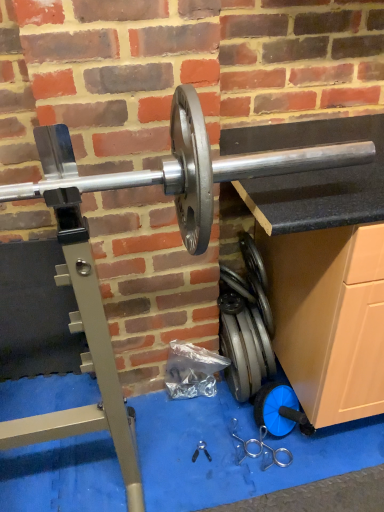
Question: Is the surface of black plastic pliers at center, placed as the first tool when sorted from left to right, in direct contact with silver metallic weight at lower center, acting as the 1th tool starting from the right?

Choices:
 (A) no
 (B) yes

Answer: (A)

Question: Would you say black plastic pliers at center, placed as the first tool when sorted from left to right, contains silver metallic weight at lower center, the second tool from the left?

Choices:
 (A) yes
 (B) no

Answer: (B)

Question: Is black plastic pliers at center, which is the 2th tool from right to left, behind silver metallic weight at lower center, the second tool from the left?

Choices:
 (A) no
 (B) yes

Answer: (B)

Question: From a real-world perspective, is black plastic pliers at center, placed as the first tool when sorted from left to right, under silver metallic weight at lower center, the second tool from the left?

Choices:
 (A) yes
 (B) no

Answer: (A)

Question: Is black plastic pliers at center, placed as the first tool when sorted from left to right, not close to silver metallic weight at lower center, acting as the 1th tool starting from the right?

Choices:
 (A) yes
 (B) no

Answer: (B)

Question: Is black plastic pliers at center, placed as the first tool when sorted from left to right, smaller than silver metallic weight at lower center, acting as the 1th tool starting from the right?

Choices:
 (A) no
 (B) yes

Answer: (B)

Question: Is silver metallic barbell at center inside silver metallic weight at lower center, acting as the 1th tool starting from the right?

Choices:
 (A) yes
 (B) no

Answer: (B)

Question: Is silver metallic weight at lower center, the second tool from the left, to the left of silver metallic barbell at center from the viewer's perspective?

Choices:
 (A) no
 (B) yes

Answer: (A)

Question: Is silver metallic weight at lower center, acting as the 1th tool starting from the right, located outside silver metallic barbell at center?

Choices:
 (A) no
 (B) yes

Answer: (B)

Question: From a real-world perspective, is silver metallic weight at lower center, the second tool from the left, positioned over silver metallic barbell at center based on gravity?

Choices:
 (A) yes
 (B) no

Answer: (B)

Question: Is silver metallic weight at lower center, acting as the 1th tool starting from the right, at the right side of silver metallic barbell at center?

Choices:
 (A) yes
 (B) no

Answer: (A)

Question: From a real-world perspective, does silver metallic weight at lower center, the second tool from the left, sit lower than silver metallic barbell at center?

Choices:
 (A) no
 (B) yes

Answer: (B)

Question: Can you confirm if black plastic pliers at center, which is the 2th tool from right to left, is shorter than silver metallic barbell at center?

Choices:
 (A) yes
 (B) no

Answer: (A)